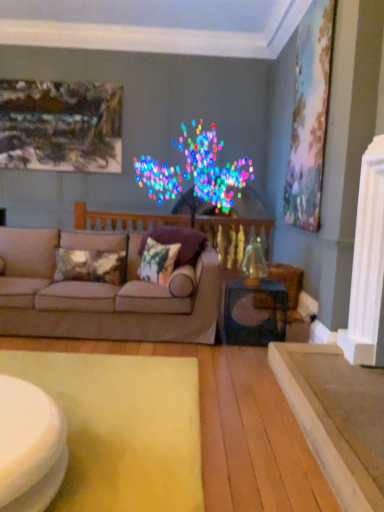
Identify the location of blank space situated above yellow felt mat at lower left (from a real-world perspective). (93, 403).